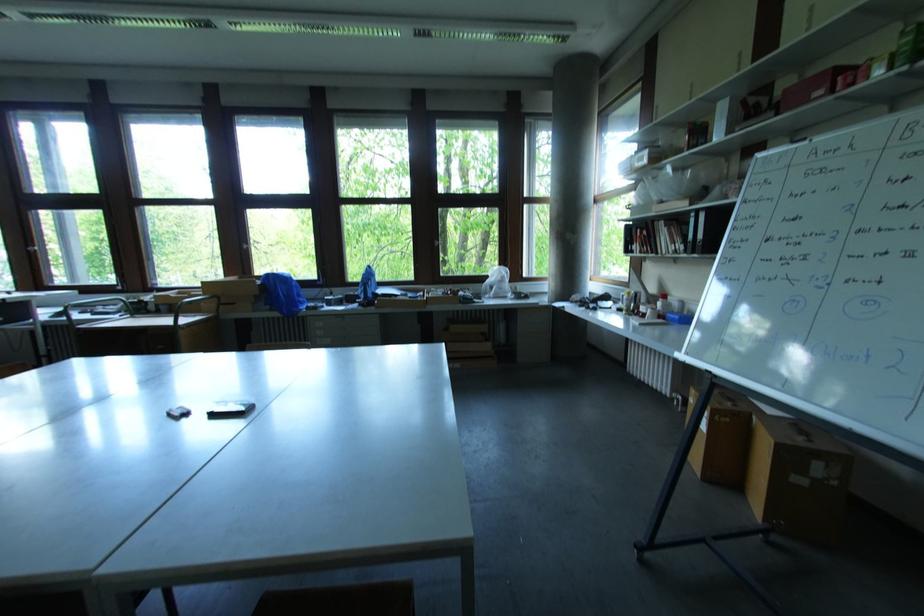
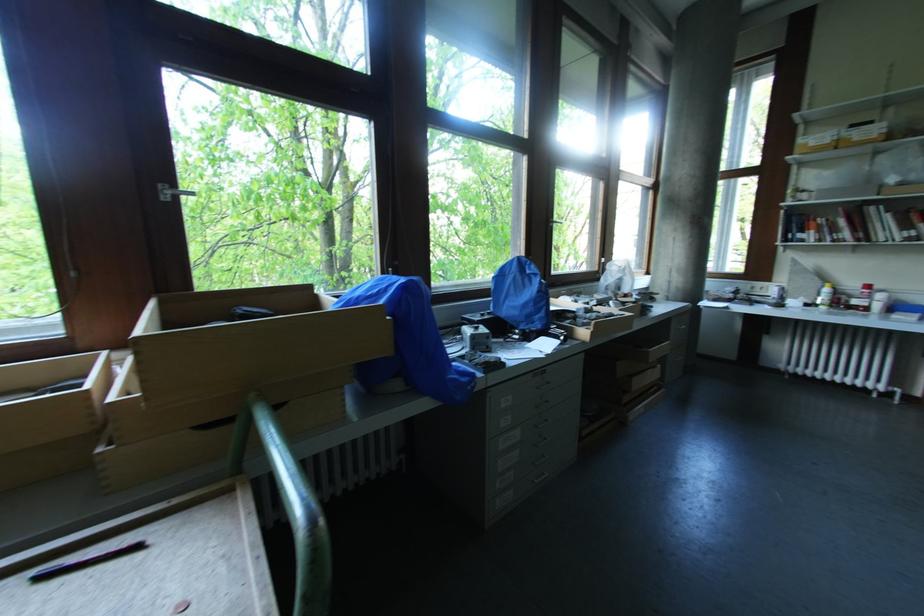
Find the pixel in the second image that matches point 663,306 in the first image.

(882, 298)